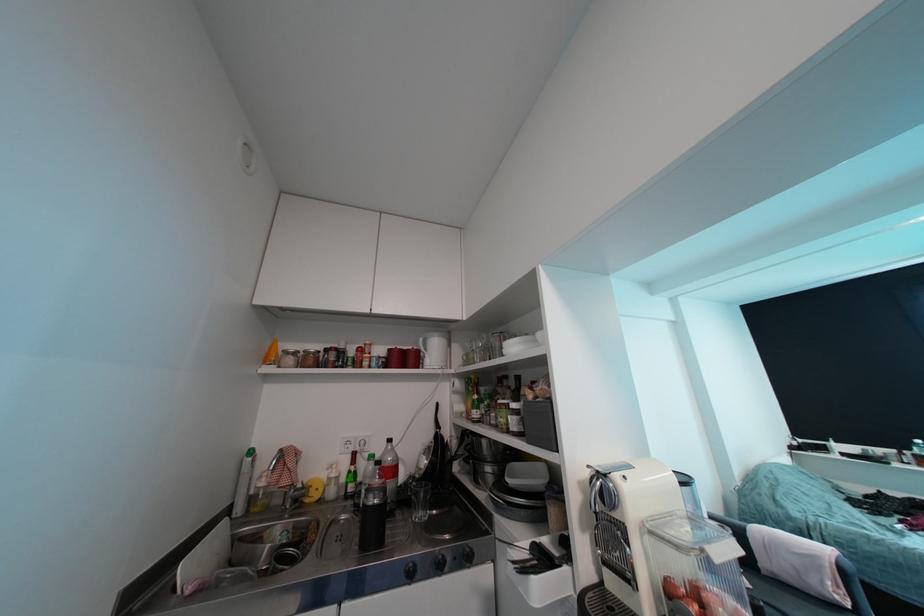
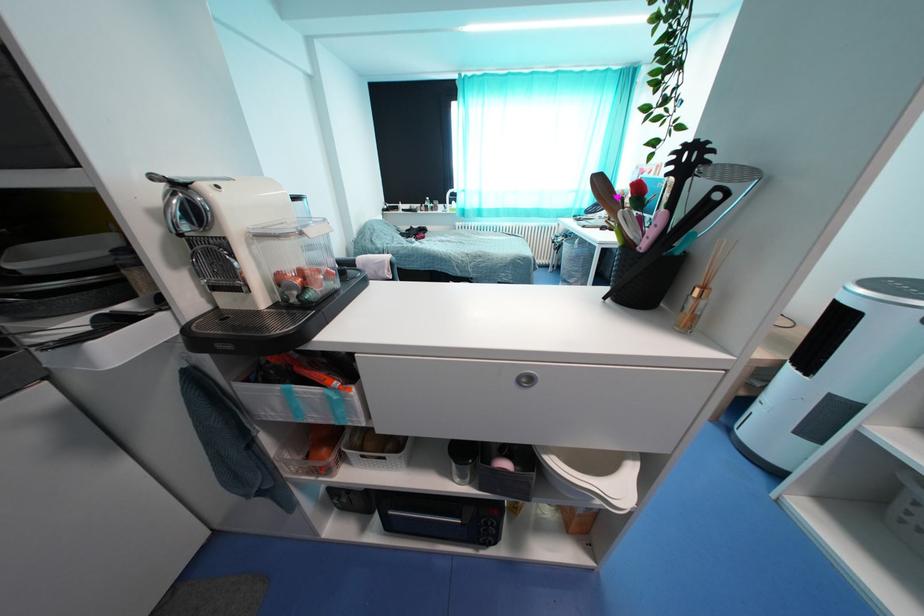
The first image is from the beginning of the video and the second image is from the end. How did the camera likely rotate when shooting the video?

The camera's rotation is toward right-down.